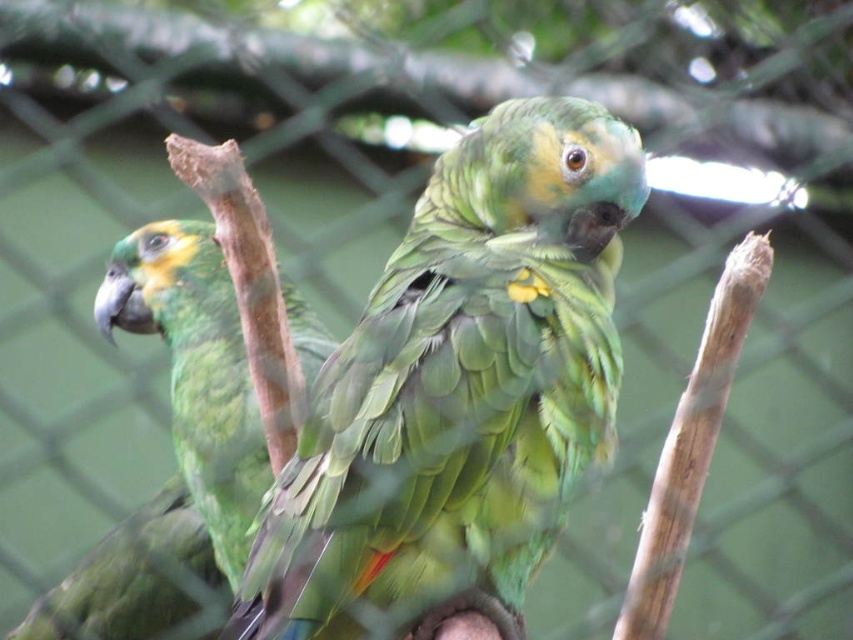
Measure the distance between point (610, 404) and camera.

The distance of point (610, 404) from camera is 1.75 meters.

Does point (457, 506) come in front of point (221, 355)?

Yes.

Is point (512, 220) farther from viewer compared to point (154, 305)?

No, (512, 220) is closer to viewer.

You are a GUI agent. You are given a task and a screenshot of the screen. Output one action in this format:
    pyautogui.click(x=<x>, y=<y>)
    Task: Click on the green matte parrot at center
    The image size is (853, 640).
    Given the screenshot: What is the action you would take?
    pyautogui.click(x=459, y=388)